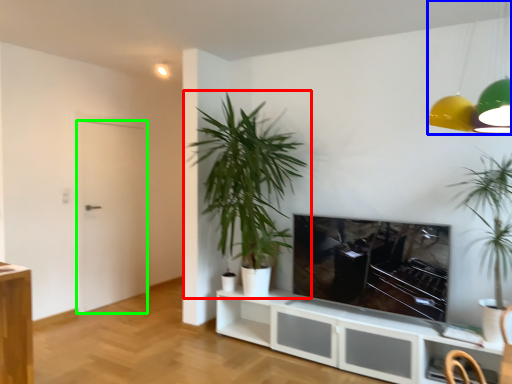
Question: Considering the real-world distances, which object is closest to houseplant (highlighted by a red box)? lamp (highlighted by a blue box) or door (highlighted by a green box).

Choices:
 (A) lamp
 (B) door

Answer: (B)